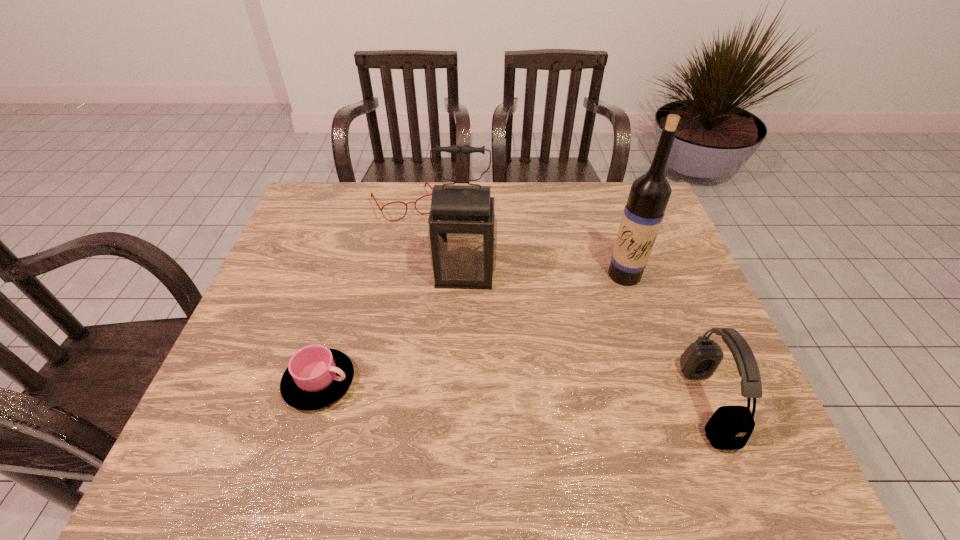
This screenshot has width=960, height=540. In order to click on cup located in the near edge section of the desktop in this screenshot , I will do `click(316, 377)`.

The width and height of the screenshot is (960, 540). I want to click on headset positioned at the near edge, so click(730, 427).

The image size is (960, 540). In order to click on object that is at the left edge in this screenshot , I will do `click(316, 377)`.

Where is `headset present at the right edge`? headset present at the right edge is located at coordinates (730, 427).

Identify the location of wine bottle situated at the right edge. This screenshot has width=960, height=540. (649, 194).

At what (x,y) coordinates should I click in order to perform the action: click on object at the near left corner. Please return your answer as a coordinate pair (x, y). The image size is (960, 540). Looking at the image, I should click on (316, 377).

The width and height of the screenshot is (960, 540). In order to click on object that is at the near right corner in this screenshot , I will do `click(730, 427)`.

At what (x,y) coordinates should I click in order to perform the action: click on vacant area at the far edge of the desktop. Please return your answer as a coordinate pair (x, y). The height and width of the screenshot is (540, 960). Looking at the image, I should click on (533, 184).

Where is `free region at the near edge of the desktop`? This screenshot has height=540, width=960. free region at the near edge of the desktop is located at coordinates (394, 405).

The image size is (960, 540). Identify the location of free location at the left edge of the desktop. (267, 299).